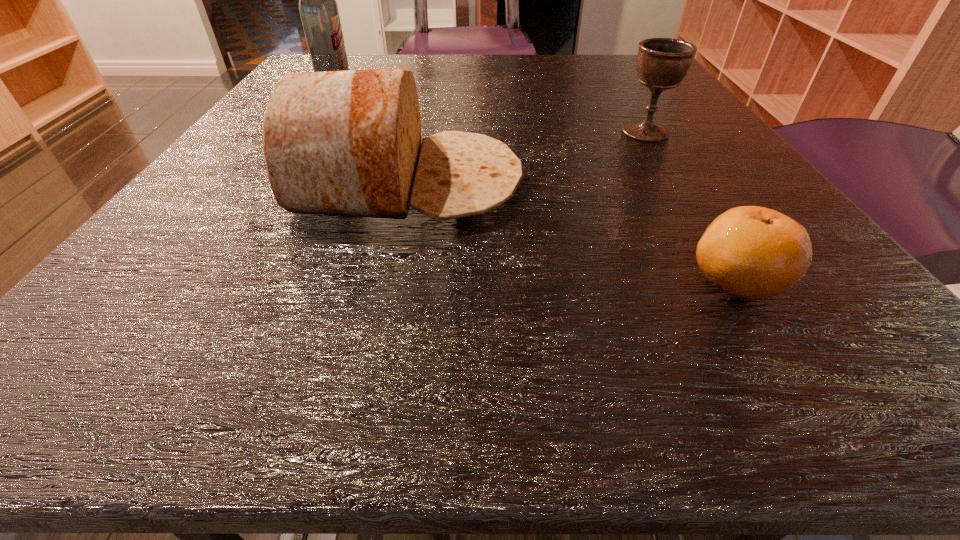
In the image, there is a desktop. What are the coordinates of `vacant space at the left edge` in the screenshot? It's located at (126, 285).

Locate an element on the screen. The height and width of the screenshot is (540, 960). vacant area at the right edge of the desktop is located at coordinates click(737, 190).

Identify the location of vacant space at the far right corner of the desktop. This screenshot has width=960, height=540. (636, 75).

I want to click on vacant area that lies between the nearest object and the bread, so click(x=572, y=231).

The image size is (960, 540). In order to click on unoccupied area between the vodka and the chalice in this screenshot , I will do `click(490, 105)`.

Identify the location of free space between the farthest object and the chalice. This screenshot has height=540, width=960. (490, 105).

Identify the location of free space between the bread and the second farthest object. This screenshot has width=960, height=540. (526, 157).

This screenshot has height=540, width=960. Find the location of `vacant space that is in between the vodka and the clementine`. vacant space that is in between the vodka and the clementine is located at coordinates click(x=535, y=179).

The image size is (960, 540). I want to click on free spot between the second nearest object and the clementine, so click(572, 231).

You are a GUI agent. You are given a task and a screenshot of the screen. Output one action in this format:
    pyautogui.click(x=<x>, y=<y>)
    Task: Click on the free space between the clementine and the chalice
    This screenshot has width=960, height=540.
    Given the screenshot: What is the action you would take?
    pyautogui.click(x=691, y=206)